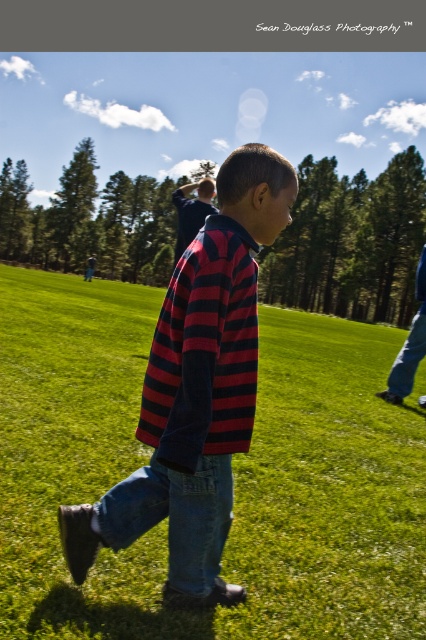
Based on the photo, between striped cotton shirt at center and denim jeans at center, which one appears on the right side from the viewer's perspective?

striped cotton shirt at center

This screenshot has height=640, width=426. Identify the location of striped cotton shirt at center. (196, 392).

Between point (158, 376) and point (201, 497), which one is positioned in front?

Point (201, 497)

Where is `striped cotton shirt at center`? striped cotton shirt at center is located at coordinates (196, 392).

Can you confirm if green grass at center is thinner than striped cotton shirt at center?

In fact, green grass at center might be wider than striped cotton shirt at center.

This screenshot has width=426, height=640. What do you see at coordinates (233, 467) in the screenshot?
I see `green grass at center` at bounding box center [233, 467].

In the scene shown: Who is more forward, (340, 525) or (219, 452)?

Point (219, 452)

The width and height of the screenshot is (426, 640). What are the coordinates of `green grass at center` in the screenshot? It's located at (233, 467).

Is denim jeans at center thinner than denim jeans at lower right?

No, denim jeans at center is not thinner than denim jeans at lower right.

Is denim jeans at center above denim jeans at lower right?

Actually, denim jeans at center is below denim jeans at lower right.

Which is behind, point (106, 525) or point (391, 365)?

Positioned behind is point (391, 365).

Where is `denim jeans at center`? denim jeans at center is located at coordinates (175, 516).